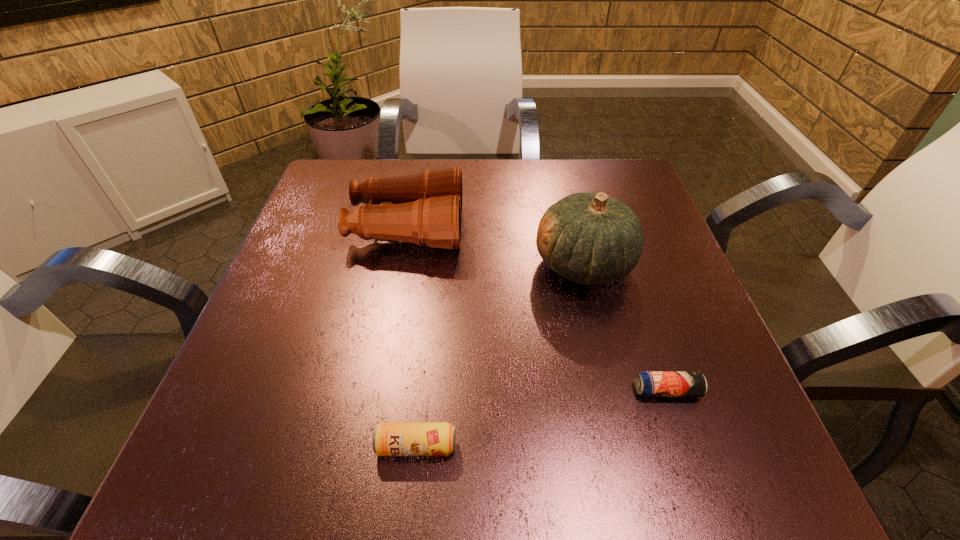
The height and width of the screenshot is (540, 960). Identify the location of object present at the far edge. (426, 208).

Locate an element on the screen. This screenshot has height=540, width=960. object that is at the near edge is located at coordinates (389, 438).

Where is `object present at the left edge`? The image size is (960, 540). object present at the left edge is located at coordinates (426, 208).

Where is `gourd located at the right edge`? gourd located at the right edge is located at coordinates (592, 239).

The image size is (960, 540). In order to click on beer can located at the right edge in this screenshot , I will do `click(648, 383)`.

Where is `object at the far left corner`? The height and width of the screenshot is (540, 960). object at the far left corner is located at coordinates (426, 208).

This screenshot has height=540, width=960. In the image, there is a desktop. Find the location of `vacant space at the far edge`. vacant space at the far edge is located at coordinates (477, 213).

In the image, there is a desktop. At what (x,y) coordinates should I click in order to perform the action: click on vacant space at the near edge. Please return your answer as a coordinate pair (x, y). This screenshot has height=540, width=960. Looking at the image, I should click on (416, 476).

The image size is (960, 540). I want to click on vacant region at the left edge of the desktop, so click(285, 307).

Find the location of `vacant space at the right edge of the desktop`. vacant space at the right edge of the desktop is located at coordinates (637, 279).